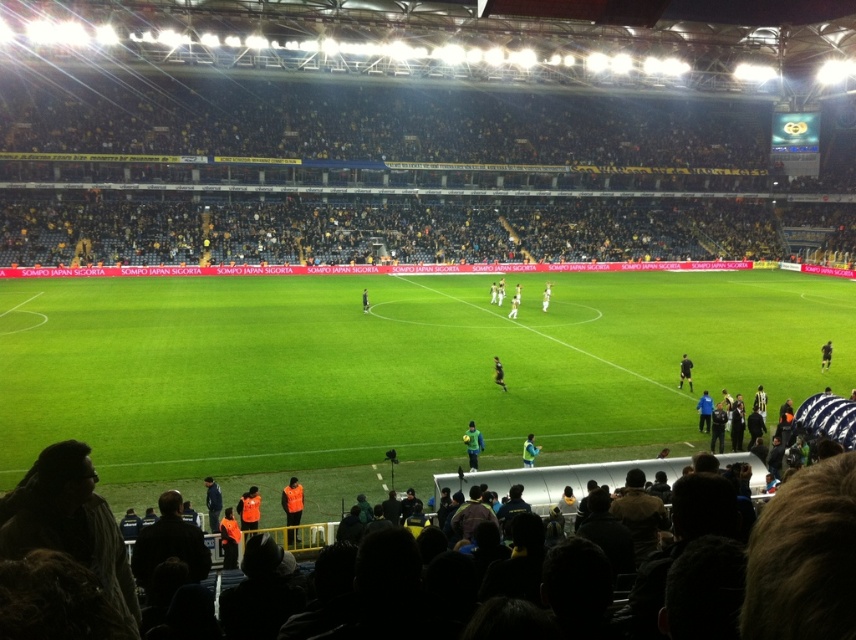
Question: Does orange reflective vest at lower center appear over dark blue jersey at center?

Choices:
 (A) yes
 (B) no

Answer: (B)

Question: Among these points, which one is nearest to the camera?

Choices:
 (A) (821, 349)
 (B) (468, 460)
 (C) (516, 296)
 (D) (548, 291)

Answer: (B)

Question: Which point is farther to the camera?

Choices:
 (A) black uniform at center
 (B) dark blue jersey at center
 (C) orange reflective vest at lower center
 (D) white jersey at center

Answer: (D)

Question: Which object is farther from the camera taking this photo?

Choices:
 (A) blue fabric jacket at lower left
 (B) black matte referee at right
 (C) green grass football field at center
 (D) dark blue jersey at center

Answer: (B)

Question: Is blue fabric jacket at lower left closer to the viewer compared to black jersey at center?

Choices:
 (A) yes
 (B) no

Answer: (A)

Question: Can you confirm if blue fabric jacket at lower left is positioned to the right of white jersey at center?

Choices:
 (A) no
 (B) yes

Answer: (A)